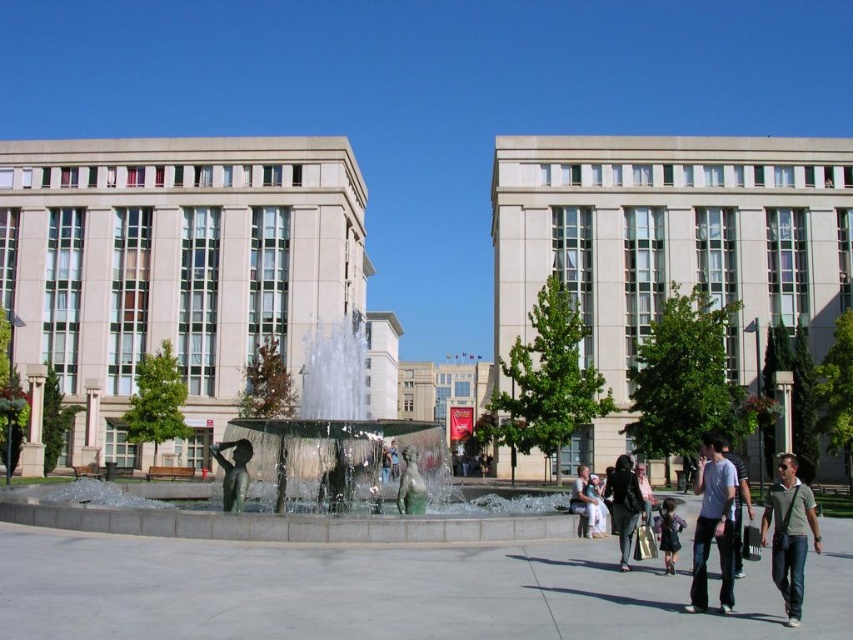
Which is above, gray cotton t-shirt at lower right or polished bronze statue at center?

gray cotton t-shirt at lower right is higher up.

Is point (730, 538) farther from viewer compared to point (236, 442)?

No.

You are a GUI agent. You are given a task and a screenshot of the screen. Output one action in this format:
    pyautogui.click(x=<x>, y=<y>)
    Task: Click on the gray cotton t-shirt at lower right
    Image resolution: width=853 pixels, height=640 pixels.
    Given the screenshot: What is the action you would take?
    pyautogui.click(x=712, y=525)

Is black fabric jacket at lower right to the left of dark blue denim jeans at lower right from the viewer's perspective?

In fact, black fabric jacket at lower right is to the right of dark blue denim jeans at lower right.

Identify the location of black fabric jacket at lower right. Image resolution: width=853 pixels, height=640 pixels. (624, 504).

Between point (611, 470) and point (669, 499), which one is positioned in front?

Positioned in front is point (669, 499).

Image resolution: width=853 pixels, height=640 pixels. What are the coordinates of `black fabric jacket at lower right` in the screenshot? It's located at (624, 504).

Identify the location of green polished water at center. Image resolution: width=853 pixels, height=640 pixels. (303, 480).

Which is above, green polished water at center or light brown fabric dress at center?

green polished water at center

Between point (265, 540) and point (596, 488), which one is positioned in front?

Point (265, 540) is in front.

Locate an element on the screen. Image resolution: width=853 pixels, height=640 pixels. green polished water at center is located at coordinates (303, 480).